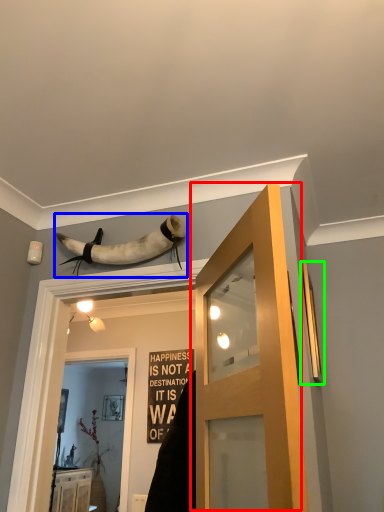
Question: Which object is the farthest from door (highlighted by a red box)? Choose among these: animal (highlighted by a blue box) or window (highlighted by a green box).

Choices:
 (A) animal
 (B) window

Answer: (B)